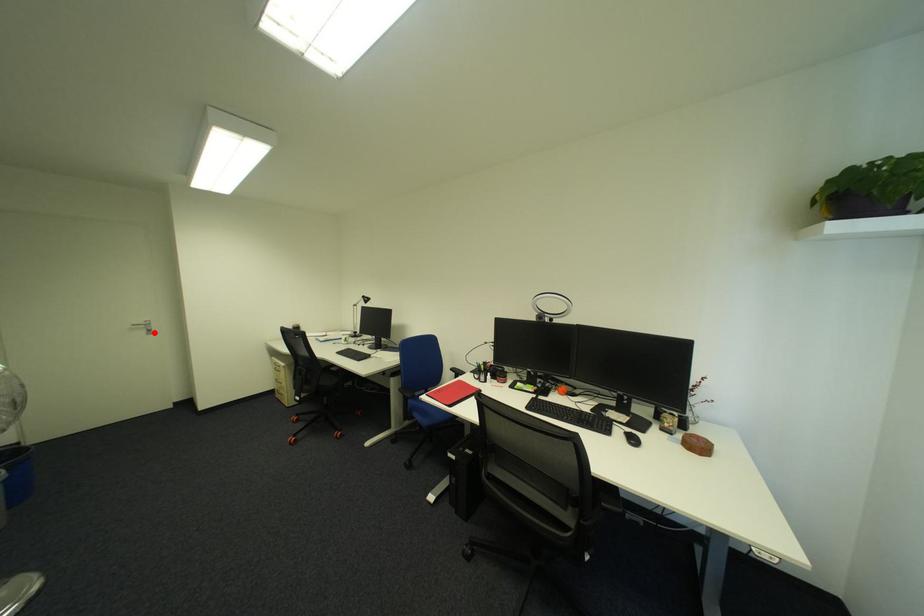
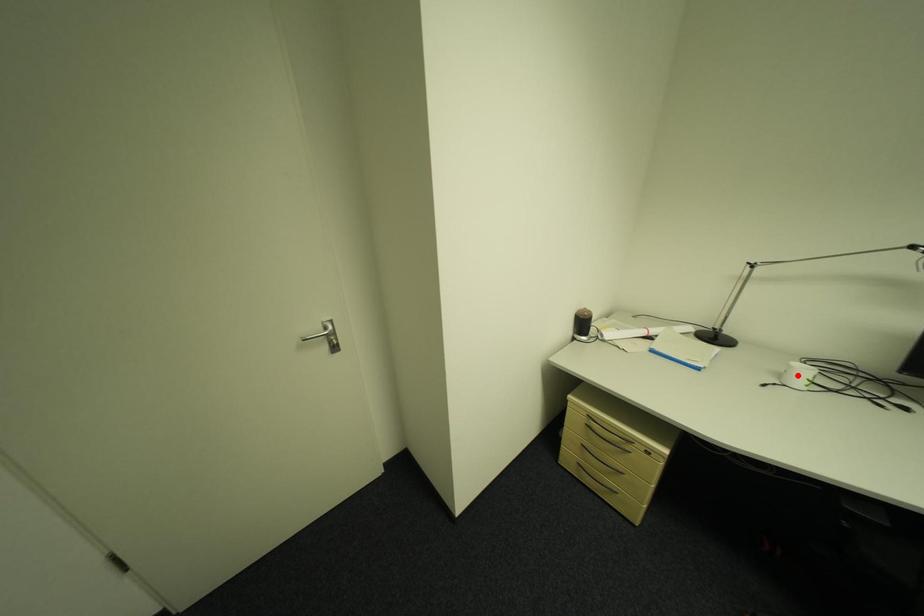
I am providing you with two images of the same scene from different viewpoints. A red point is marked on the first image and another point is marked on the second image. Is the red point in image1 aligned with the point shown in image2?

No